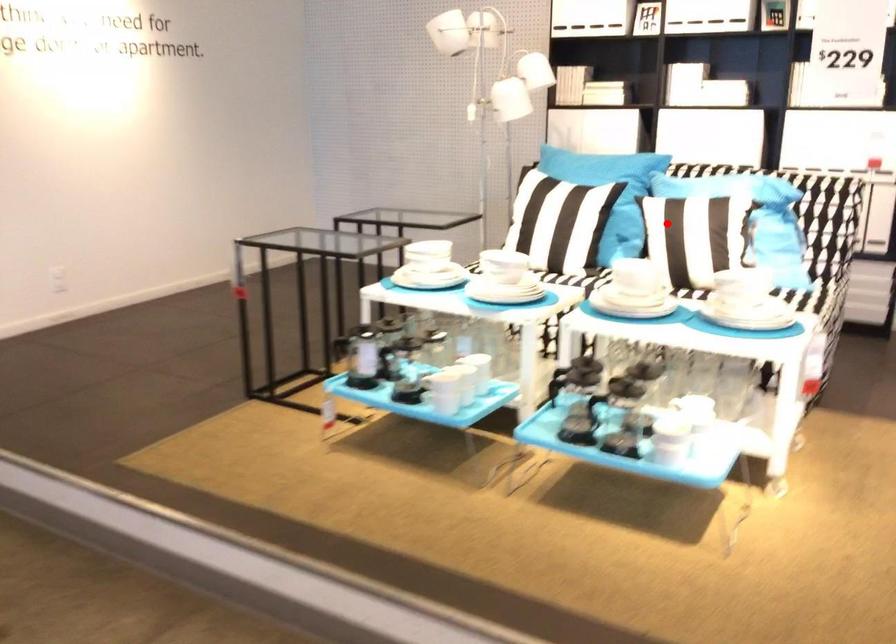
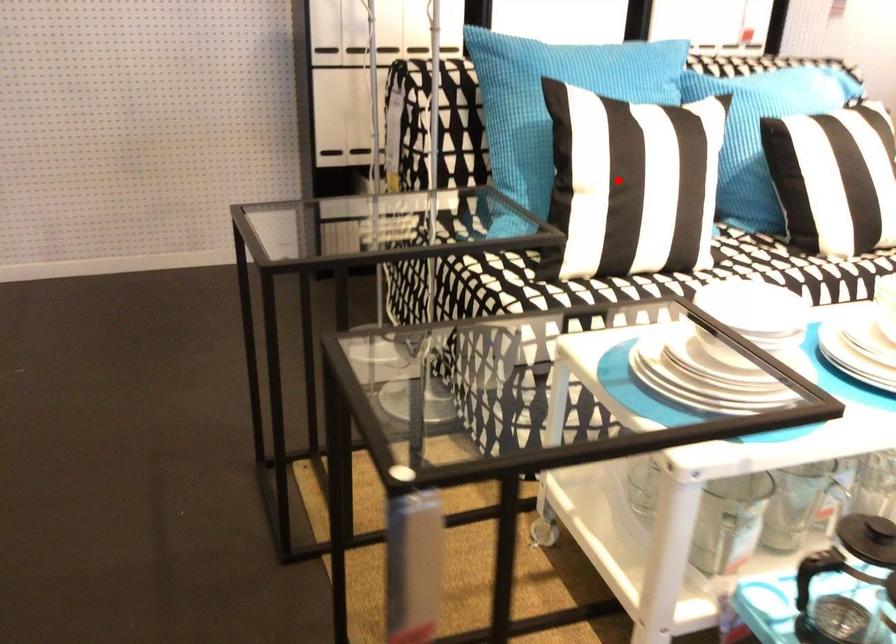
I am providing you with two images of the same scene from different viewpoints. A red point is marked on the first image and another point is marked on the second image. Is the marked point in image1 the same physical position as the marked point in image2?

No